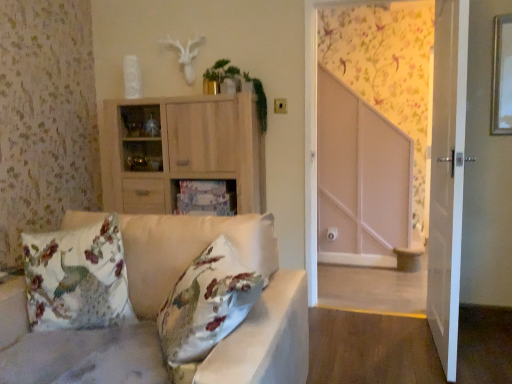
Question: From a real-world perspective, is white glossy door at right under floral wallpaper at upper right?

Choices:
 (A) yes
 (B) no

Answer: (A)

Question: From a real-world perspective, is white glossy door at right located higher than floral wallpaper at upper right?

Choices:
 (A) yes
 (B) no

Answer: (B)

Question: Is white glossy door at right bigger than floral wallpaper at upper right?

Choices:
 (A) no
 (B) yes

Answer: (B)

Question: Does white glossy door at right come behind floral wallpaper at upper right?

Choices:
 (A) yes
 (B) no

Answer: (B)

Question: Is white glossy door at right at the left side of floral wallpaper at upper right?

Choices:
 (A) yes
 (B) no

Answer: (B)

Question: Is the depth of white glossy door at right less than that of floral wallpaper at upper right?

Choices:
 (A) yes
 (B) no

Answer: (A)

Question: Is light wood cabinet at center, placed as the 2th cabinetry when sorted from bottom to top, in contact with satin white studio couch at left?

Choices:
 (A) no
 (B) yes

Answer: (A)

Question: Is light wood cabinet at center, placed as the 2th cabinetry when sorted from bottom to top, aimed at satin white studio couch at left?

Choices:
 (A) no
 (B) yes

Answer: (B)

Question: Is light wood cabinet at center, the first cabinetry from the top, at the right side of satin white studio couch at left?

Choices:
 (A) yes
 (B) no

Answer: (A)

Question: From a real-world perspective, is light wood cabinet at center, the first cabinetry from the top, below satin white studio couch at left?

Choices:
 (A) yes
 (B) no

Answer: (B)

Question: From the image's perspective, is light wood cabinet at center, the first cabinetry from the top, under satin white studio couch at left?

Choices:
 (A) no
 (B) yes

Answer: (A)

Question: Considering the relative sizes of light wood cabinet at center, placed as the 2th cabinetry when sorted from bottom to top, and satin white studio couch at left in the image provided, is light wood cabinet at center, placed as the 2th cabinetry when sorted from bottom to top, bigger than satin white studio couch at left?

Choices:
 (A) yes
 (B) no

Answer: (B)

Question: Are floral fabric cushion at left and satin white studio couch at left far apart?

Choices:
 (A) yes
 (B) no

Answer: (B)